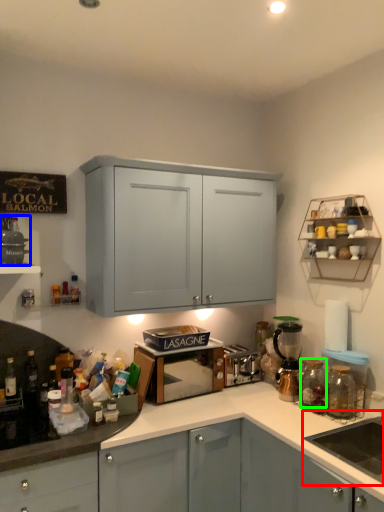
Question: Estimate the real-world distances between objects in this image. Which object is farther from sink (highlighted by a red box), appliance (highlighted by a blue box) or glass jar (highlighted by a green box)?

Choices:
 (A) appliance
 (B) glass jar

Answer: (A)